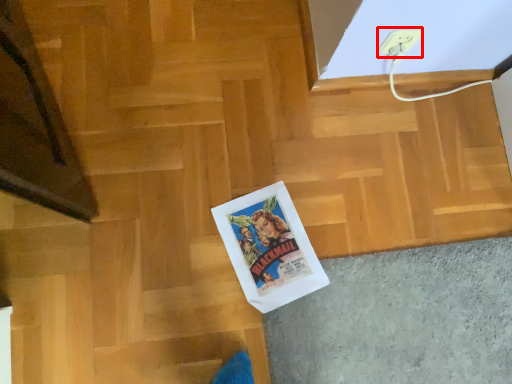
Question: From the image's perspective, where is electric outlet (annotated by the red box) located relative to stairwell?

Choices:
 (A) below
 (B) above

Answer: (B)